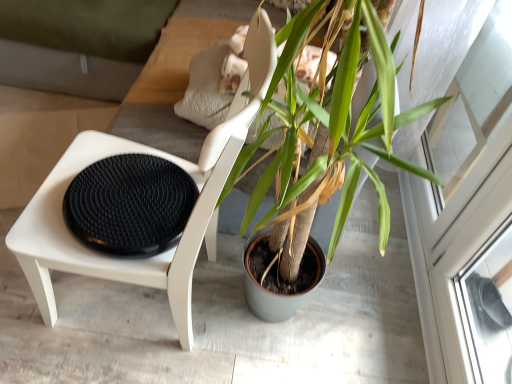
Question: Would you say green matte plant at center is outside transparent glass screen door at upper right?

Choices:
 (A) no
 (B) yes

Answer: (B)

Question: Is green matte plant at center wider than transparent glass screen door at upper right?

Choices:
 (A) yes
 (B) no

Answer: (A)

Question: Would you say green matte plant at center contains transparent glass screen door at upper right?

Choices:
 (A) yes
 (B) no

Answer: (B)

Question: Is green matte plant at center at the right side of transparent glass screen door at upper right?

Choices:
 (A) no
 (B) yes

Answer: (A)

Question: Could you tell me if green matte plant at center is facing transparent glass screen door at upper right?

Choices:
 (A) yes
 (B) no

Answer: (B)

Question: Is green matte plant at center looking in the opposite direction of transparent glass screen door at upper right?

Choices:
 (A) no
 (B) yes

Answer: (A)

Question: Is the position of green matte plant pot at center more distant than that of white matte chair at left?

Choices:
 (A) no
 (B) yes

Answer: (B)

Question: Does green matte plant pot at center have a greater height compared to white matte chair at left?

Choices:
 (A) no
 (B) yes

Answer: (A)

Question: Can you confirm if green matte plant pot at center is positioned to the right of white matte chair at left?

Choices:
 (A) yes
 (B) no

Answer: (B)

Question: Is green matte plant pot at center surrounding white matte chair at left?

Choices:
 (A) no
 (B) yes

Answer: (A)

Question: From the image's perspective, does green matte plant pot at center appear lower than white matte chair at left?

Choices:
 (A) no
 (B) yes

Answer: (B)

Question: Is green matte plant pot at center facing away from white matte chair at left?

Choices:
 (A) yes
 (B) no

Answer: (B)

Question: Does green matte plant pot at center have a lesser width compared to black textured footrest at left?

Choices:
 (A) no
 (B) yes

Answer: (A)